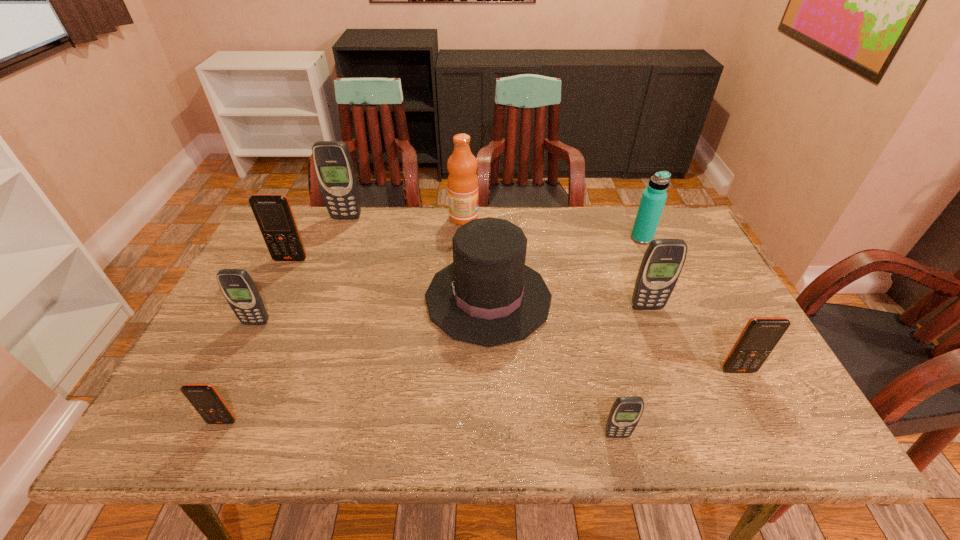
Select which cellular telephone is the fifth closest to the seventh object from left to right. Please provide its 2D coordinates. Your answer should be formatted as a tuple, i.e. [(x, y)], where the tuple contains the x and y coordinates of a point satisfying the conditions above.

[(273, 213)]

The width and height of the screenshot is (960, 540). I want to click on gray cellular telephone that stands as the third closest to the fruit juice, so click(x=240, y=291).

Identify which gray cellular telephone is the closest to the rightmost orange cellular telephone. Please provide its 2D coordinates. Your answer should be formatted as a tuple, i.e. [(x, y)], where the tuple contains the x and y coordinates of a point satisfying the conditions above.

[(662, 263)]

At what (x,y) coordinates should I click in order to perform the action: click on the second closest orange cellular telephone relative to the second farthest orange cellular telephone. Please return your answer as a coordinate pair (x, y). The width and height of the screenshot is (960, 540). Looking at the image, I should click on (273, 213).

Identify which orange cellular telephone is the third closest to the second biggest gray cellular telephone. Please provide its 2D coordinates. Your answer should be formatted as a tuple, i.e. [(x, y)], where the tuple contains the x and y coordinates of a point satisfying the conditions above.

[(204, 397)]

Identify the location of free space that satisfies the following two spatial constraints: 1. on the back side of the eighth nearest object; 2. on the label side of the fruit juice. The image size is (960, 540). click(x=633, y=218).